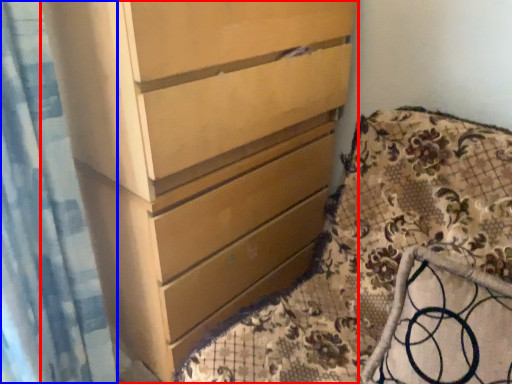
Question: Which of the following is the closest to the observer, chest of drawers (highlighted by a red box) or shower curtain (highlighted by a blue box)?

Choices:
 (A) chest of drawers
 (B) shower curtain

Answer: (B)